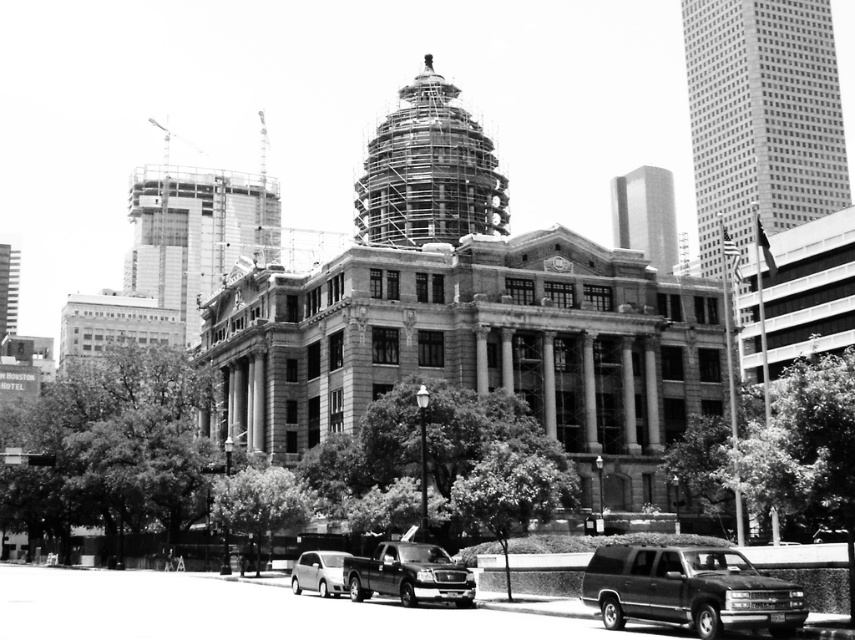
Question: Does shiny black suv at lower right appear under silver metallic hatchback at lower left?

Choices:
 (A) yes
 (B) no

Answer: (B)

Question: Considering the real-world distances, which object is farthest from the shiny black truck at lower center?

Choices:
 (A) silver metallic hatchback at lower left
 (B) shiny black suv at lower right

Answer: (B)

Question: Which point is closer to the camera?

Choices:
 (A) shiny black truck at lower center
 (B) shiny black suv at lower right

Answer: (B)

Question: Can you confirm if shiny black truck at lower center is positioned to the left of silver metallic hatchback at lower left?

Choices:
 (A) yes
 (B) no

Answer: (B)

Question: Among these points, which one is farthest from the camera?

Choices:
 (A) (447, 556)
 (B) (305, 588)

Answer: (B)

Question: Is the position of shiny black truck at lower center more distant than that of silver metallic hatchback at lower left?

Choices:
 (A) yes
 (B) no

Answer: (B)